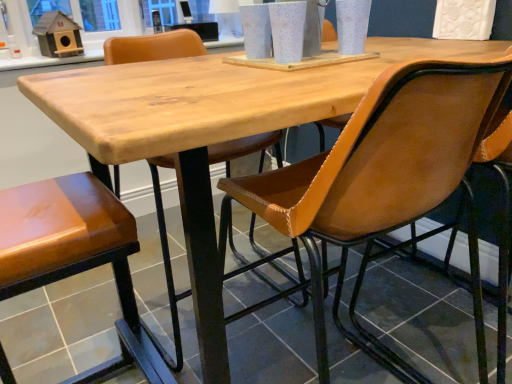
Find the location of a particular element. vacant region above glossy brown leather chair at lower left, positioned as the 2th chair in right-to-left order (from a real-world perspective) is located at coordinates (41, 203).